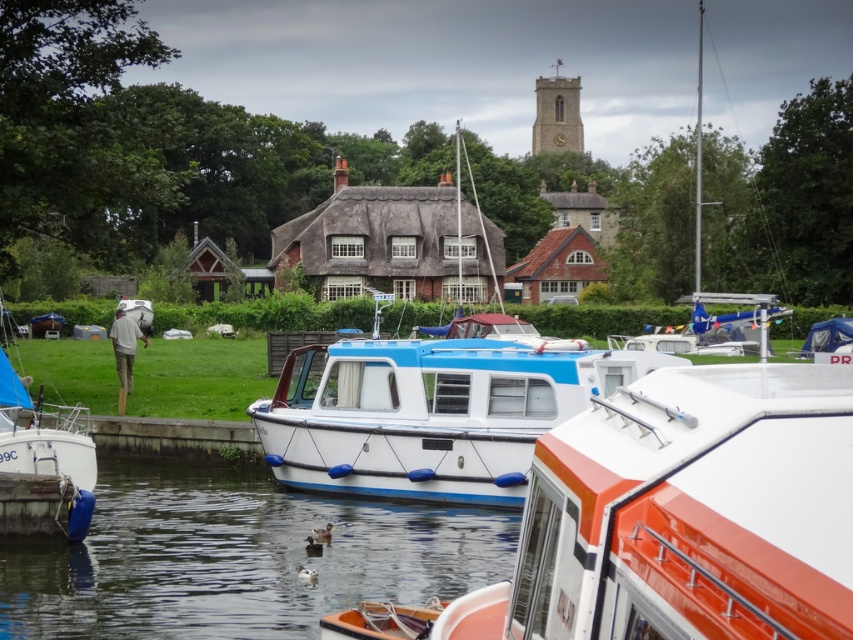
Who is more forward, (154, 465) or (550, 417)?

Point (550, 417)

Does white plastic boat at center appear on the left side of blue matte boat at center?

Correct, you'll find white plastic boat at center to the left of blue matte boat at center.

Is point (253, 474) behind point (357, 346)?

That is True.

Find the location of a particular element. The image size is (853, 640). white plastic boat at center is located at coordinates (238, 557).